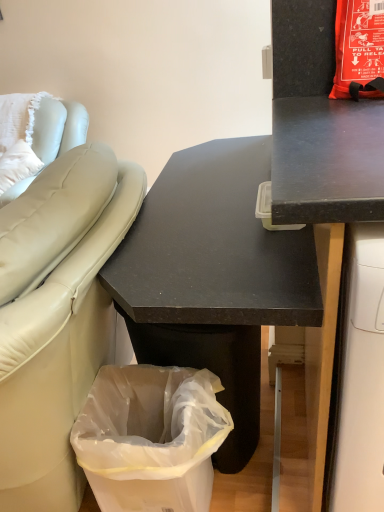
Question: Is black matte desk at center, which appears as the first desk when viewed from the left, in front of or behind black matte desk at upper right, the second desk when ordered from left to right, in the image?

Choices:
 (A) front
 (B) behind

Answer: (B)

Question: Based on their sizes in the image, would you say black matte desk at center, which appears as the first desk when viewed from the left, is bigger or smaller than black matte desk at upper right, the second desk when ordered from left to right?

Choices:
 (A) small
 (B) big

Answer: (B)

Question: Based on their relative distances, which object is nearer to the transparent plastic bag at lower left?

Choices:
 (A) white leather couch at left
 (B) black matte desk at upper right, the first desk positioned from the right
 (C) black matte desk at center, which appears as the first desk when viewed from the left

Answer: (C)

Question: Considering the real-world distances, which object is farthest from the white leather couch at left?

Choices:
 (A) black matte desk at center, which appears as the first desk when viewed from the left
 (B) transparent plastic bag at lower left
 (C) black matte desk at upper right, the first desk positioned from the right

Answer: (C)